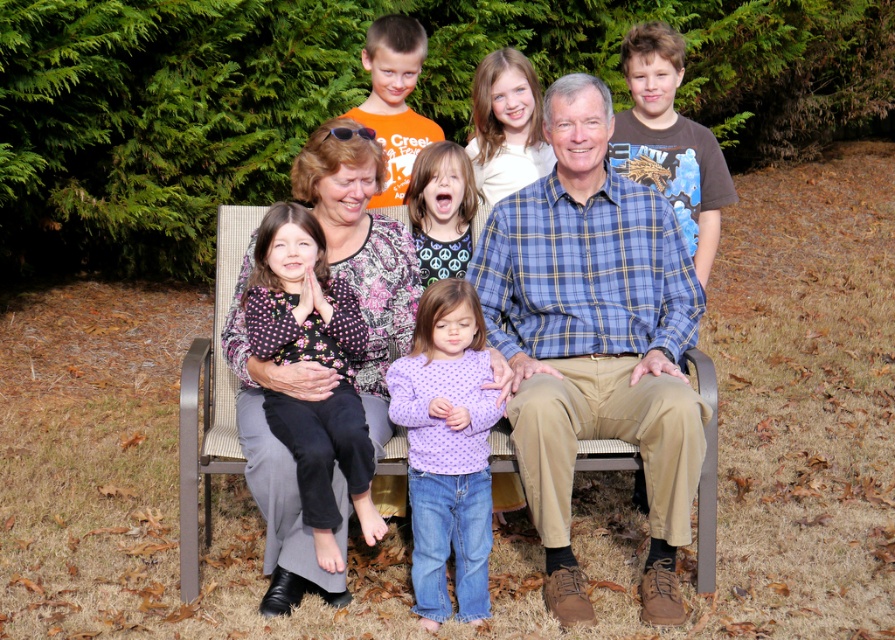
Question: Which is farther from the purple polka dot sweater at lower center?

Choices:
 (A) floral-patterned shirt at center
 (B) matte plaid shirt at center
 (C) blue plaid shirt at center

Answer: (C)

Question: Does floral-patterned shirt at center appear on the left side of purple dotted shirt at center?

Choices:
 (A) yes
 (B) no

Answer: (A)

Question: Is matte plaid shirt at center positioned in front of purple polka dot sweater at lower center?

Choices:
 (A) no
 (B) yes

Answer: (B)

Question: Which of the following is the farthest from the observer?

Choices:
 (A) (665, 326)
 (B) (467, 211)
 (C) (479, 396)

Answer: (B)

Question: Is matte plaid shirt at center to the right of blue plaid shirt at center from the viewer's perspective?

Choices:
 (A) yes
 (B) no

Answer: (A)

Question: Which object is positioned farthest from the purple dotted shirt at center?

Choices:
 (A) floral-patterned shirt at center
 (B) blue plaid shirt at center
 (C) purple polka dot sweater at lower center

Answer: (C)